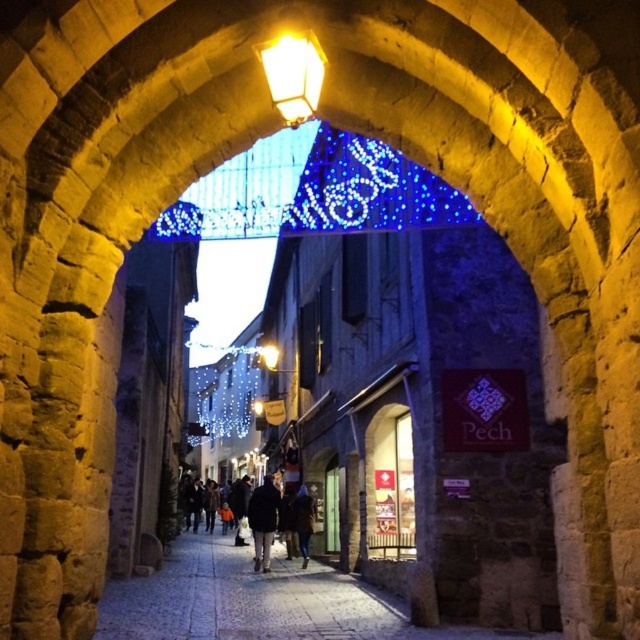
Does illuminated string lights at center have a lesser height compared to matte yellow light at center?

Incorrect, illuminated string lights at center's height does not fall short of matte yellow light at center's.

Is illuminated string lights at center closer to camera compared to matte yellow light at center?

No, illuminated string lights at center is behind matte yellow light at center.

Which is in front, point (205, 422) or point (268, 342)?

Point (268, 342) is more forward.

Find the location of `illuminated string lights at center`. illuminated string lights at center is located at coordinates (225, 392).

Does illuminated string lights at center have a lesser height compared to yellow glass streetlight at upper center?

In fact, illuminated string lights at center may be taller than yellow glass streetlight at upper center.

Is point (248, 392) behind point (296, 125)?

Yes, it is.

The width and height of the screenshot is (640, 640). Identify the location of illuminated string lights at center. (225, 392).

Looking at this image, is dark gray coat at center further to the viewer compared to matte yellow light at center?

No.

Looking at this image, does dark gray coat at center have a greater width compared to matte yellow light at center?

Correct, the width of dark gray coat at center exceeds that of matte yellow light at center.

The image size is (640, 640). What do you see at coordinates (269, 516) in the screenshot?
I see `dark gray coat at center` at bounding box center [269, 516].

Locate an element on the screen. This screenshot has width=640, height=640. dark gray coat at center is located at coordinates (269, 516).